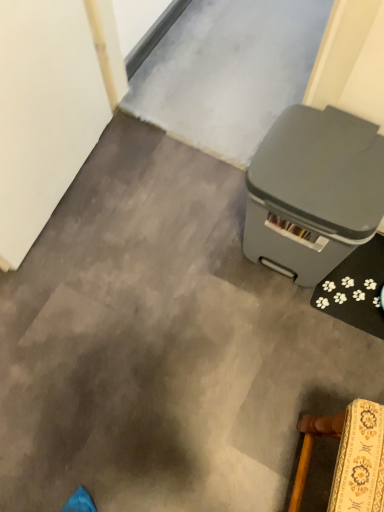
I want to click on free space between wooden upholstered chair at lower right and gray plastic waste bin at right, so click(x=303, y=345).